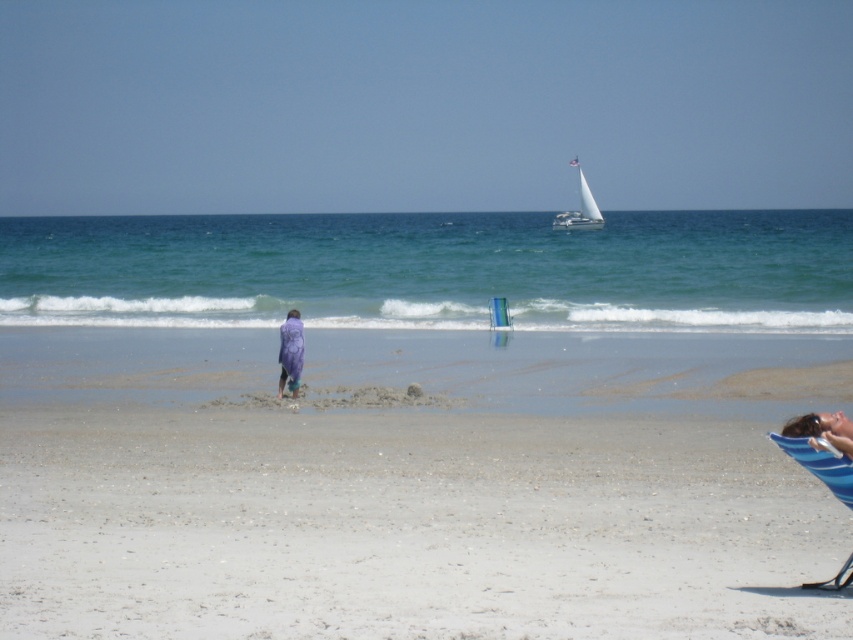
Does blue fabric beach chair at lower right have a greater height compared to white sailboat at upper center?

No, blue fabric beach chair at lower right is not taller than white sailboat at upper center.

Consider the image. Is blue fabric beach chair at lower right bigger than white sailboat at upper center?

Actually, blue fabric beach chair at lower right might be smaller than white sailboat at upper center.

Does point (850, 486) come farther from viewer compared to point (564, 221)?

No, it is not.

The image size is (853, 640). Find the location of `blue fabric beach chair at lower right`. blue fabric beach chair at lower right is located at coordinates (820, 465).

Which is in front, point (113, 344) or point (506, 324)?

Positioned in front is point (113, 344).

Does white sand beach at center have a smaller size compared to transparent plastic chair at center?

No, white sand beach at center is not smaller than transparent plastic chair at center.

Find the location of `white sand beach at center`. white sand beach at center is located at coordinates (407, 525).

Identify the location of blonde hair person at lower right. This screenshot has height=640, width=853. (822, 429).

Can you confirm if blonde hair person at lower right is positioned below white sailboat at upper center?

Yes.

Which is in front, point (792, 420) or point (584, 214)?

Point (792, 420) is in front.

You are a GUI agent. You are given a task and a screenshot of the screen. Output one action in this format:
    pyautogui.click(x=<x>, y=<y>)
    Task: Click on the blonde hair person at lower right
    This screenshot has width=853, height=640.
    Given the screenshot: What is the action you would take?
    pyautogui.click(x=822, y=429)